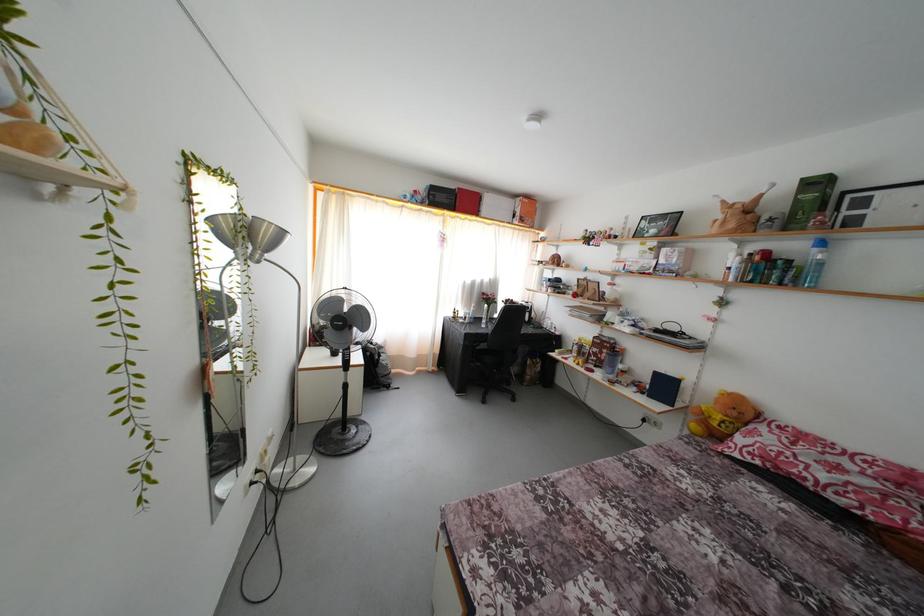
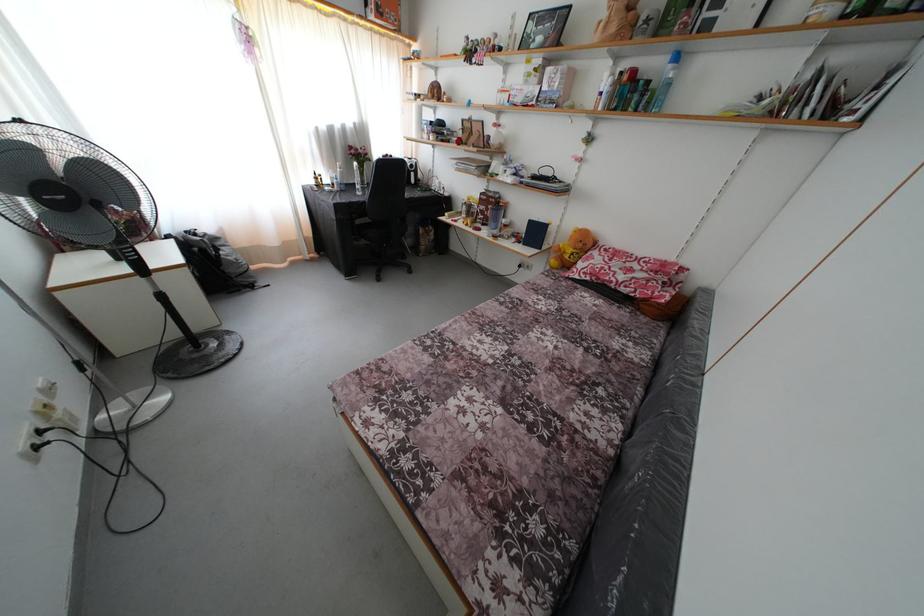
Where in the second image is the point corresponding to point 468,337 from the first image?

(335, 207)